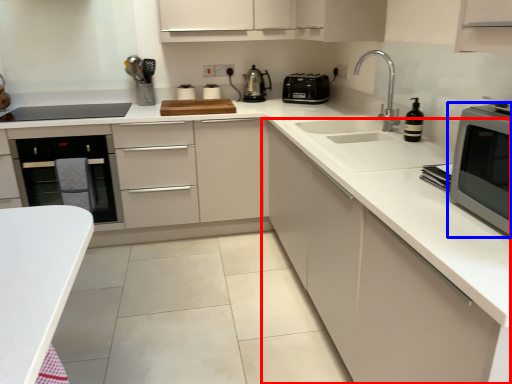
Question: Which object is further to the camera taking this photo, cabinetry (highlighted by a red box) or home appliance (highlighted by a blue box)?

Choices:
 (A) cabinetry
 (B) home appliance

Answer: (B)